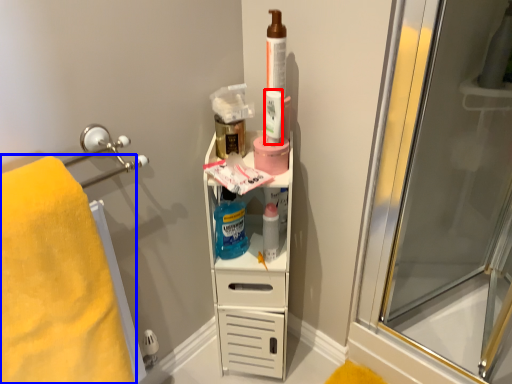
Question: Which point is closer to the camera, mouthwash (highlighted by a red box) or towel (highlighted by a blue box)?

Choices:
 (A) mouthwash
 (B) towel

Answer: (B)